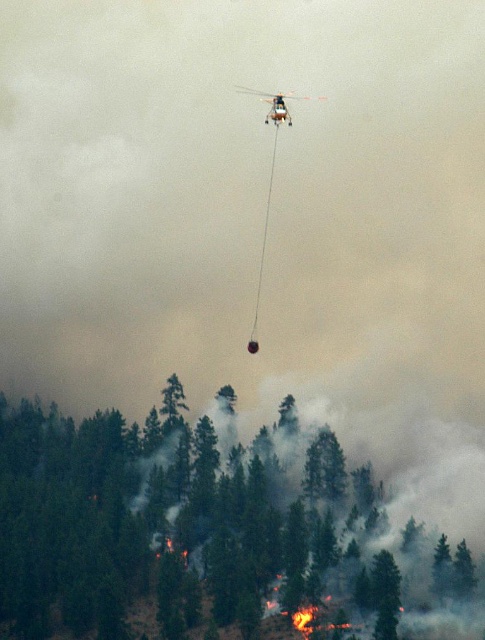
Question: Can you confirm if green matte tree at lower center is positioned above metallic silver helicopter at upper center?

Choices:
 (A) no
 (B) yes

Answer: (A)

Question: From the image, what is the correct spatial relationship of green matte tree at lower center in relation to metallic silver helicopter at upper center?

Choices:
 (A) below
 (B) above

Answer: (A)

Question: Which of the following is the farthest from the observer?

Choices:
 (A) green matte tree at lower center
 (B) metallic silver helicopter at upper center

Answer: (A)

Question: Is green matte tree at lower center below metallic silver helicopter at upper center?

Choices:
 (A) no
 (B) yes

Answer: (B)